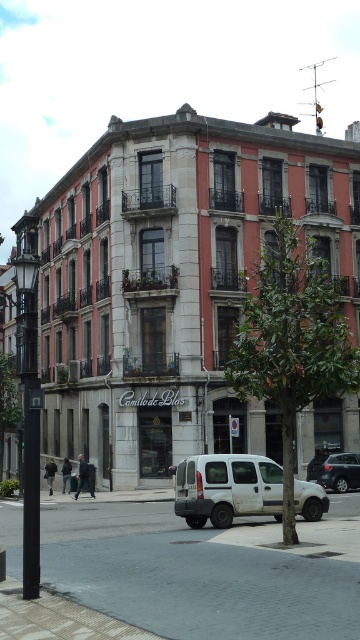
You are a delivery driver trying to park your white matte van at lower center in a narrow alley next to the black metal pole at left. Can your van fit between the pole and the building without touching either?

The white matte van at lower center is narrower than the black metal pole at left, so it should fit between them without touching either.